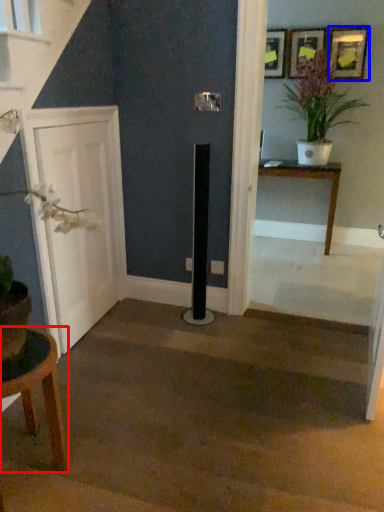
Question: Which point is further to the camera, table (highlighted by a red box) or picture frame (highlighted by a blue box)?

Choices:
 (A) table
 (B) picture frame

Answer: (B)